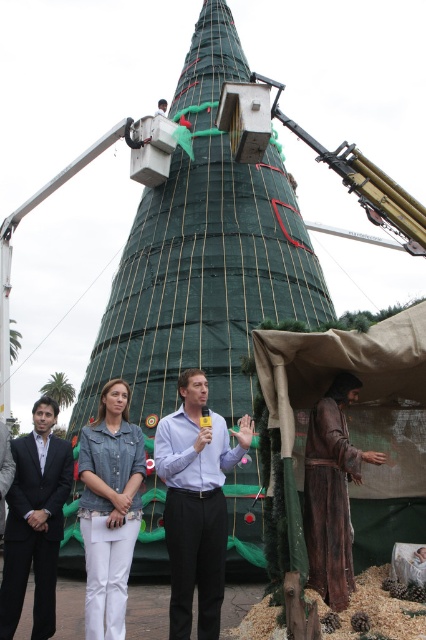
Question: Can you confirm if denim jacket at center is smaller than dark blue suit at lower left?

Choices:
 (A) no
 (B) yes

Answer: (B)

Question: Among these points, which one is nearest to the camera?

Choices:
 (A) (216, 461)
 (B) (345, 561)
 (C) (146, 124)

Answer: (B)

Question: Which point is closer to the camera?

Choices:
 (A) brown leather robe at lower right
 (B) green netted christmas tree at center
 (C) matte blue shirt at center
 (D) dark blue suit at lower left

Answer: (A)

Question: Is green netted christmas tree at center below brown leather robe at lower right?

Choices:
 (A) no
 (B) yes

Answer: (A)

Question: Can you confirm if matte blue shirt at center is positioned to the right of dark blue suit at lower left?

Choices:
 (A) yes
 (B) no

Answer: (A)

Question: Which object is farther from the camera taking this photo?

Choices:
 (A) matte blue shirt at center
 (B) dark blue suit at lower left
 (C) denim jacket at center
 (D) green netted christmas tree at center

Answer: (D)